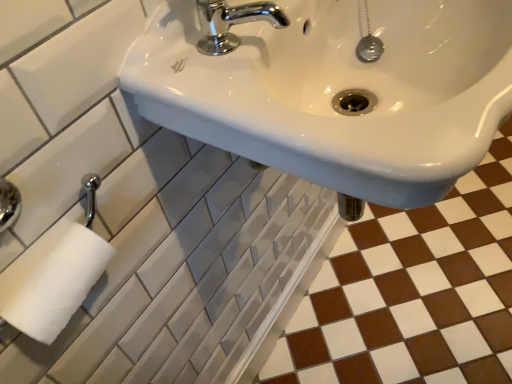
Question: From the image's perspective, does chrome/metallic faucet at upper center appear lower than brown glossy tile at lower right?

Choices:
 (A) yes
 (B) no

Answer: (B)

Question: From a real-world perspective, is chrome/metallic faucet at upper center positioned over brown glossy tile at lower right based on gravity?

Choices:
 (A) yes
 (B) no

Answer: (A)

Question: Does chrome/metallic faucet at upper center have a lesser height compared to brown glossy tile at lower right?

Choices:
 (A) no
 (B) yes

Answer: (A)

Question: Are chrome/metallic faucet at upper center and brown glossy tile at lower right making contact?

Choices:
 (A) no
 (B) yes

Answer: (A)

Question: Is chrome/metallic faucet at upper center to the right of brown glossy tile at lower right from the viewer's perspective?

Choices:
 (A) no
 (B) yes

Answer: (A)

Question: From their relative heights in the image, would you say chrome/metallic faucet at upper center is taller or shorter than white glossy sink at upper center?

Choices:
 (A) tall
 (B) short

Answer: (B)

Question: Is point (222, 11) positioned closer to the camera than point (411, 148)?

Choices:
 (A) closer
 (B) farther

Answer: (B)

Question: Considering the positions of chrome/metallic faucet at upper center and white glossy sink at upper center in the image, is chrome/metallic faucet at upper center wider or thinner than white glossy sink at upper center?

Choices:
 (A) thin
 (B) wide

Answer: (A)

Question: Is chrome/metallic faucet at upper center bigger or smaller than white glossy sink at upper center?

Choices:
 (A) small
 (B) big

Answer: (A)

Question: In the image, is chrome/metallic faucet at upper center on the left side or the right side of brown glossy tile at lower right?

Choices:
 (A) left
 (B) right

Answer: (A)

Question: Is chrome/metallic faucet at upper center situated inside brown glossy tile at lower right or outside?

Choices:
 (A) inside
 (B) outside

Answer: (B)

Question: Considering the positions of chrome/metallic faucet at upper center and brown glossy tile at lower right in the image, is chrome/metallic faucet at upper center bigger or smaller than brown glossy tile at lower right?

Choices:
 (A) big
 (B) small

Answer: (B)

Question: Does point tap(237, 18) appear closer or farther from the camera than point tap(417, 332)?

Choices:
 (A) closer
 (B) farther

Answer: (A)

Question: Considering their positions, is white glossy sink at upper center located in front of or behind chrome/metallic faucet at upper center?

Choices:
 (A) front
 (B) behind

Answer: (A)

Question: Would you say white glossy sink at upper center is to the left or to the right of chrome/metallic faucet at upper center in the picture?

Choices:
 (A) left
 (B) right

Answer: (B)